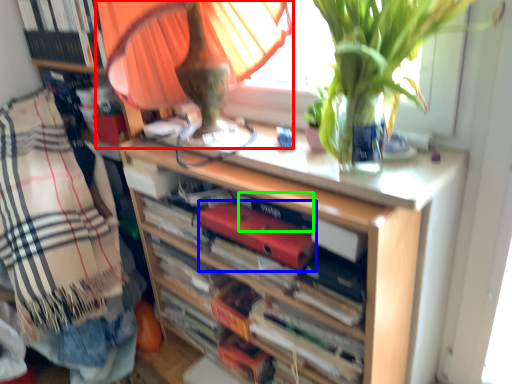
Question: Which object is positioned farthest from table lamp (highlighted by a red box)? Select from paperback book (highlighted by a blue box) and paperback book (highlighted by a green box).

Choices:
 (A) paperback book
 (B) paperback book

Answer: (B)